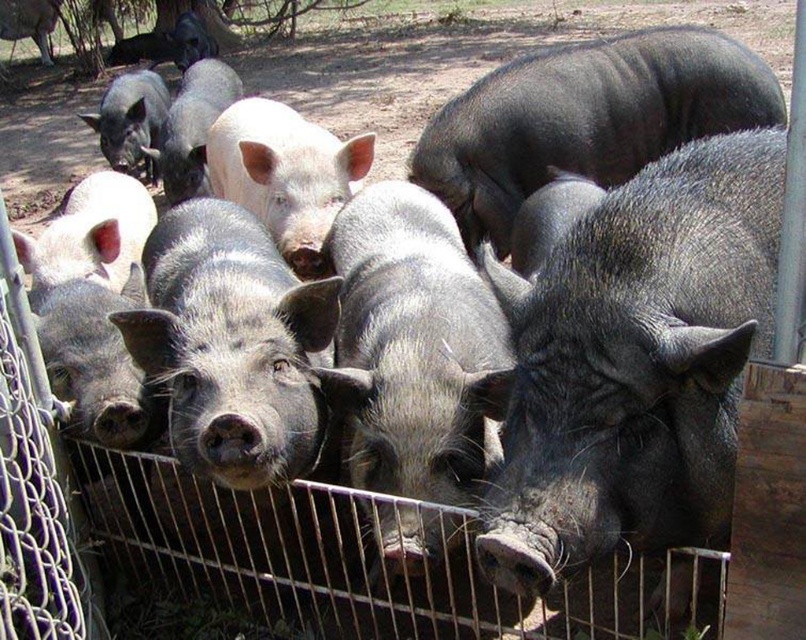
Does gray matte pig at center have a greater width compared to shiny black pig at center?

In fact, gray matte pig at center might be narrower than shiny black pig at center.

How far apart are gray matte pig at center and shiny black pig at center?

→ A distance of 1.02 meters exists between gray matte pig at center and shiny black pig at center.

Identify the location of gray matte pig at center. (413, 349).

In order to click on gray matte pig at center in this screenshot , I will do `click(413, 349)`.

Between gray textured pig at center and shiny black pig at center, which one has less height?

shiny black pig at center

Does gray textured pig at center appear on the right side of shiny black pig at center?

Incorrect, gray textured pig at center is not on the right side of shiny black pig at center.

Where is `gray textured pig at center`? The image size is (806, 640). gray textured pig at center is located at coordinates (634, 364).

Who is lower down, gray textured pig at center or gray matte pig at center?

gray textured pig at center is lower down.

Does gray textured pig at center have a greater width compared to gray matte pig at center?

Yes.

Is point (676, 589) positioned in front of point (404, 385)?

No, it is behind (404, 385).

You are a GUI agent. You are given a task and a screenshot of the screen. Output one action in this format:
    pyautogui.click(x=<x>, y=<y>)
    Task: Click on the gray textured pig at center
    
    Given the screenshot: What is the action you would take?
    pyautogui.click(x=634, y=364)